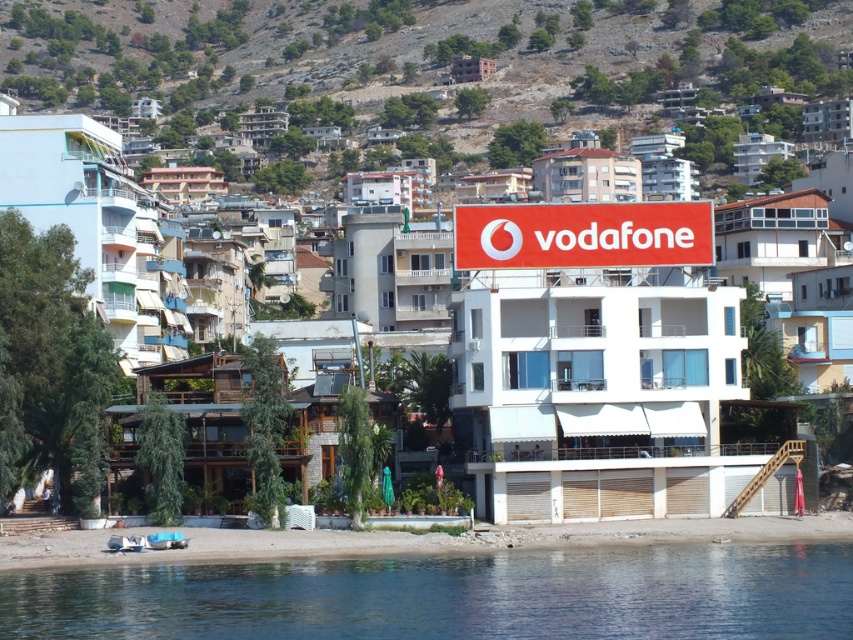
Can you confirm if white matte building at center is positioned to the left of red matte sign at center?

Indeed, white matte building at center is positioned on the left side of red matte sign at center.

Is white matte building at center in front of red matte sign at center?

Yes, white matte building at center is in front of red matte sign at center.

Locate an element on the screen. This screenshot has width=853, height=640. white matte building at center is located at coordinates (572, 349).

Can you confirm if green leafy hillside at upper center is positioned to the left of smooth sand beach at lower center?

Yes, green leafy hillside at upper center is to the left of smooth sand beach at lower center.

Which is below, green leafy hillside at upper center or smooth sand beach at lower center?

smooth sand beach at lower center

You are a GUI agent. You are given a task and a screenshot of the screen. Output one action in this format:
    pyautogui.click(x=<x>, y=<y>)
    Task: Click on the green leafy hillside at upper center
    
    Given the screenshot: What is the action you would take?
    pyautogui.click(x=422, y=54)

Between point (370, 625) and point (544, 209), which one is positioned in front?

Point (370, 625) is more forward.

Based on the photo, can you confirm if transparent blue water at lower center is positioned below red matte sign at center?

Yes.

This screenshot has height=640, width=853. Describe the element at coordinates (451, 595) in the screenshot. I see `transparent blue water at lower center` at that location.

The image size is (853, 640). Identify the location of transparent blue water at lower center. (451, 595).